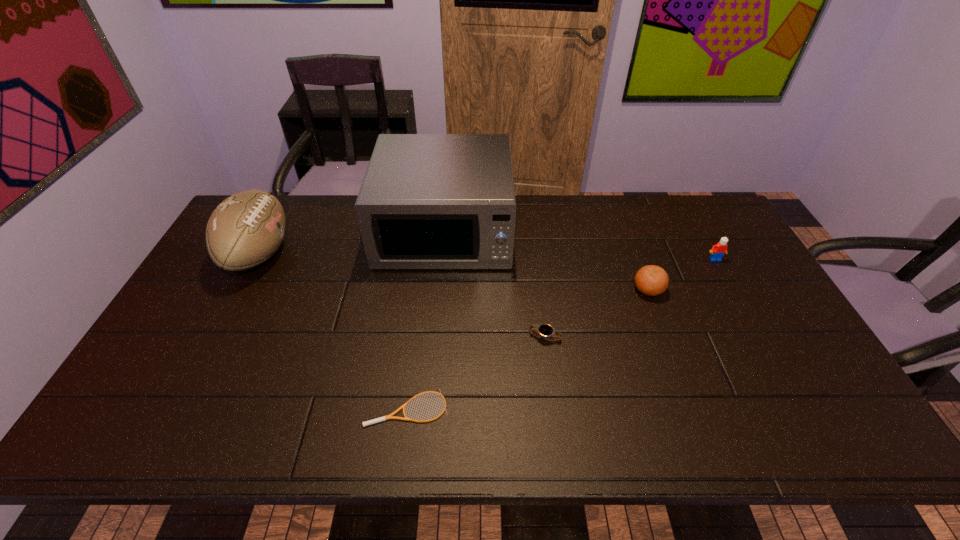
You are a GUI agent. You are given a task and a screenshot of the screen. Output one action in this format:
    pyautogui.click(x=<x>, y=<y>)
    Task: Click on the vacant region located 0.100m with the door open on the microwave oven
    Image resolution: width=960 pixels, height=540 pixels.
    Given the screenshot: What is the action you would take?
    pyautogui.click(x=439, y=298)

Where is `vacant space located 0.140m on the laces of the second tallest object`? Image resolution: width=960 pixels, height=540 pixels. vacant space located 0.140m on the laces of the second tallest object is located at coordinates (335, 254).

Identify the location of vacant position located on the face of the rightmost object. (751, 323).

Locate an element on the screen. free space located on the left of the fifth object from left to right is located at coordinates (615, 289).

Where is `vacant space located on the right of the watch`? vacant space located on the right of the watch is located at coordinates (691, 337).

This screenshot has height=540, width=960. I want to click on free location located on the right of the nearest object, so click(503, 408).

Find the location of a particular element. The image size is (960, 540). microwave oven that is at the far edge is located at coordinates (427, 201).

What are the coordinates of `football (American) present at the far edge` in the screenshot? It's located at (246, 229).

Image resolution: width=960 pixels, height=540 pixels. Identify the location of object that is at the near edge. (390, 416).

The image size is (960, 540). What are the coordinates of `object present at the left edge` in the screenshot? It's located at (246, 229).